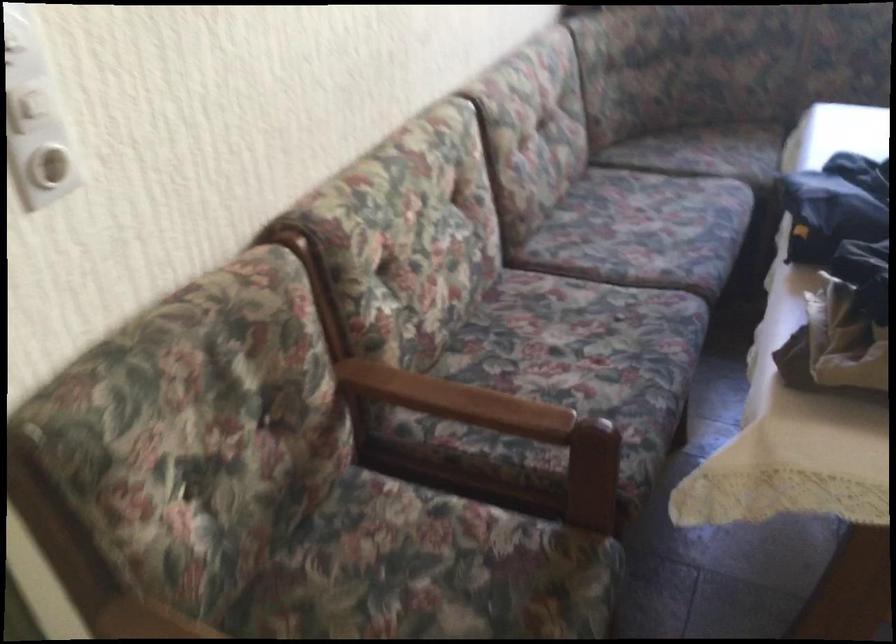
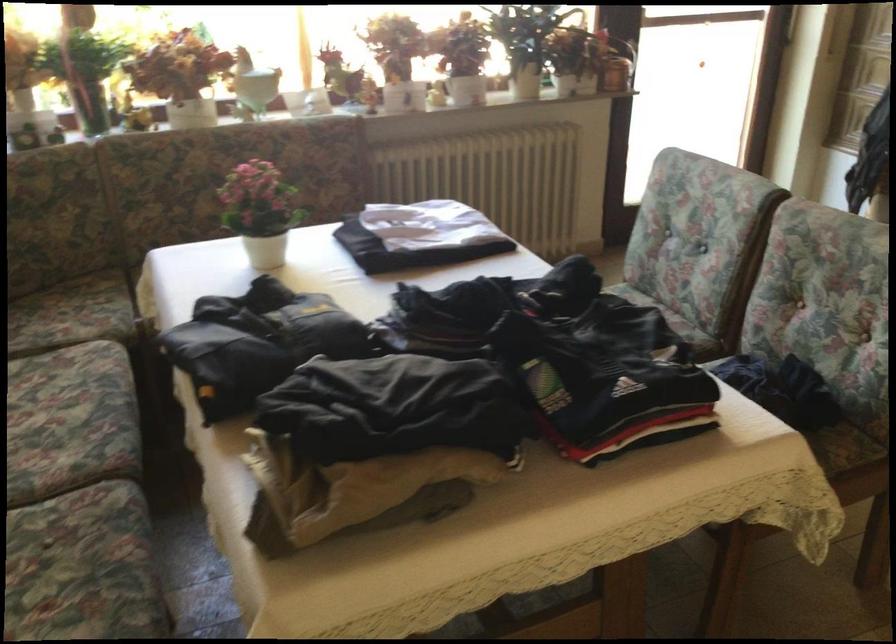
Find the pixel in the second image that matches the point at 659,228 in the first image.

(69, 413)